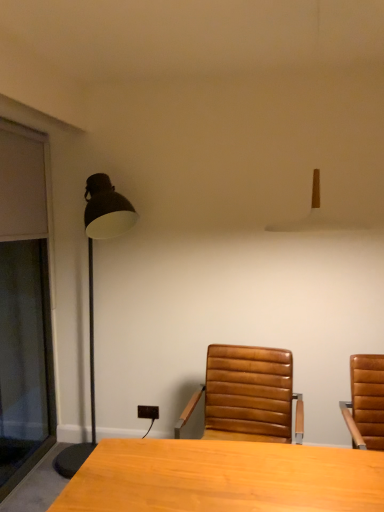
At what (x,y) coordinates should I click in order to perform the action: click on white matte lampshade at upper center, the 1th lamp viewed from the front. Please return your answer as a coordinate pair (x, y). This screenshot has height=512, width=384. Looking at the image, I should click on pos(315,216).

Based on the photo, does leather at center appear on the left side of white matte lampshade at upper center, the 1th lamp viewed from the front?

Indeed, leather at center is positioned on the left side of white matte lampshade at upper center, the 1th lamp viewed from the front.

Is leather at center placed right next to white matte lampshade at upper center, the 1th lamp viewed from the front?

No, leather at center is not in contact with white matte lampshade at upper center, the 1th lamp viewed from the front.

How many degrees apart are the facing directions of leather at center and white matte lampshade at upper center, the 2th lamp in the back-to-front sequence?

leather at center and white matte lampshade at upper center, the 2th lamp in the back-to-front sequence, are facing 4.02 degrees away from each other.

Between leather at center and white matte lampshade at upper center, the 2th lamp in the back-to-front sequence, which one has smaller size?

With smaller size is white matte lampshade at upper center, the 2th lamp in the back-to-front sequence.

Is leather at center directly adjacent to matte black floor lamp at left, which is the 1th lamp in left-to-right order?

No, leather at center is not making contact with matte black floor lamp at left, which is the 1th lamp in left-to-right order.

Relative to matte black floor lamp at left, arranged as the first lamp when viewed from the back, is leather at center in front or behind?

Visually, leather at center is located in front of matte black floor lamp at left, arranged as the first lamp when viewed from the back.

You are a GUI agent. You are given a task and a screenshot of the screen. Output one action in this format:
    pyautogui.click(x=<x>, y=<y>)
    Task: Click on the chair lying in front of the matte black floor lamp at left, which is counted as the 2th lamp, starting from the right
    This screenshot has height=512, width=384.
    Given the screenshot: What is the action you would take?
    pyautogui.click(x=248, y=396)

How different are the orientations of leather at center and matte black floor lamp at left, which is counted as the 2th lamp, starting from the right, in degrees?

4.02 degrees separate the facing orientations of leather at center and matte black floor lamp at left, which is counted as the 2th lamp, starting from the right.

Can you tell me how much transparent glass screen door at left and leather at center differ in facing direction?

There is a 93.6-degree angle between the facing directions of transparent glass screen door at left and leather at center.

Does point (29, 166) appear closer or farther from the camera than point (229, 419)?

Point (29, 166) is farther from the camera than point (229, 419).

Between transparent glass screen door at left and leather at center, which one appears on the left side from the viewer's perspective?

transparent glass screen door at left.

Which is more to the right, white matte lampshade at upper center, acting as the second lamp starting from the left, or matte black floor lamp at left, which is counted as the 2th lamp, starting from the right?

From the viewer's perspective, white matte lampshade at upper center, acting as the second lamp starting from the left, appears more on the right side.

Considering the sizes of white matte lampshade at upper center, the 1th lamp viewed from the front, and matte black floor lamp at left, acting as the 2th lamp starting from the front, in the image, is white matte lampshade at upper center, the 1th lamp viewed from the front, bigger or smaller than matte black floor lamp at left, acting as the 2th lamp starting from the front,?

Considering their sizes, white matte lampshade at upper center, the 1th lamp viewed from the front, takes up less space than matte black floor lamp at left, acting as the 2th lamp starting from the front.

Measure the distance between white matte lampshade at upper center, the 1th lamp viewed from the front, and matte black floor lamp at left, which is the 1th lamp in left-to-right order.

white matte lampshade at upper center, the 1th lamp viewed from the front, is 3.48 feet away from matte black floor lamp at left, which is the 1th lamp in left-to-right order.

Is point (282, 227) less distant than point (92, 205)?

No, (282, 227) is further to viewer.

Is matte black floor lamp at left, arranged as the first lamp when viewed from the back, positioned far away from transparent glass screen door at left?

matte black floor lamp at left, arranged as the first lamp when viewed from the back, is near transparent glass screen door at left, not far away.

Which is more to the right, matte black floor lamp at left, arranged as the first lamp when viewed from the back, or transparent glass screen door at left?

From the viewer's perspective, matte black floor lamp at left, arranged as the first lamp when viewed from the back, appears more on the right side.

From the image's perspective, is matte black floor lamp at left, arranged as the first lamp when viewed from the back, located above transparent glass screen door at left?

No, from the image's perspective, matte black floor lamp at left, arranged as the first lamp when viewed from the back, is not on top of transparent glass screen door at left.

Does matte black floor lamp at left, acting as the 2th lamp starting from the front, have a lesser height compared to transparent glass screen door at left?

Yes.

Which of these two, leather at center or transparent glass screen door at left, stands shorter?

Standing shorter between the two is leather at center.

From the image's perspective, which is above, leather at center or transparent glass screen door at left?

transparent glass screen door at left appears higher in the image.

Is leather at center further to the viewer compared to transparent glass screen door at left?

No, leather at center is in front of transparent glass screen door at left.

Do you think leather at center is within transparent glass screen door at left, or outside of it?

leather at center lies outside transparent glass screen door at left.

Which is in front, point (135, 217) or point (313, 193)?

The point (313, 193) is more forward.

Is matte black floor lamp at left, which is the 1th lamp in left-to-right order, smaller than white matte lampshade at upper center, the 2th lamp in the back-to-front sequence?

Actually, matte black floor lamp at left, which is the 1th lamp in left-to-right order, might be larger than white matte lampshade at upper center, the 2th lamp in the back-to-front sequence.

Is matte black floor lamp at left, which is counted as the 2th lamp, starting from the right, oriented away from white matte lampshade at upper center, which ranks as the first lamp in right-to-left order?

No, matte black floor lamp at left, which is counted as the 2th lamp, starting from the right, is not facing the opposite direction of white matte lampshade at upper center, which ranks as the first lamp in right-to-left order.

From a real-world perspective, is matte black floor lamp at left, which is counted as the 2th lamp, starting from the right, beneath white matte lampshade at upper center, the 2th lamp in the back-to-front sequence?

Yes, from a real-world perspective, matte black floor lamp at left, which is counted as the 2th lamp, starting from the right, is under white matte lampshade at upper center, the 2th lamp in the back-to-front sequence.

Where is `the 2nd lamp positioned above the leather at center (from the image's perspective)`? Image resolution: width=384 pixels, height=512 pixels. the 2nd lamp positioned above the leather at center (from the image's perspective) is located at coordinates (315, 216).

This screenshot has height=512, width=384. Find the location of `chair below the matte black floor lamp at left, which is the 1th lamp in left-to-right order (from the image's perspective)`. chair below the matte black floor lamp at left, which is the 1th lamp in left-to-right order (from the image's perspective) is located at coordinates (248, 396).

When comparing their distances from matte black floor lamp at left, acting as the 2th lamp starting from the front, does white matte lampshade at upper center, the 1th lamp viewed from the front, or transparent glass screen door at left seem further?

Based on the image, white matte lampshade at upper center, the 1th lamp viewed from the front, appears to be further to matte black floor lamp at left, acting as the 2th lamp starting from the front.

Which object lies further to the anchor point transparent glass screen door at left, leather at center or white matte lampshade at upper center, which ranks as the first lamp in right-to-left order?

The object further to transparent glass screen door at left is white matte lampshade at upper center, which ranks as the first lamp in right-to-left order.

From the picture: From the image, which object appears to be farther from white matte lampshade at upper center, which ranks as the first lamp in right-to-left order, matte black floor lamp at left, which is counted as the 2th lamp, starting from the right, or transparent glass screen door at left?

transparent glass screen door at left is positioned further to the anchor white matte lampshade at upper center, which ranks as the first lamp in right-to-left order.

From the image, which object appears to be farther from white matte lampshade at upper center, which ranks as the first lamp in right-to-left order, transparent glass screen door at left or matte black floor lamp at left, acting as the 2th lamp starting from the front?

transparent glass screen door at left is further to white matte lampshade at upper center, which ranks as the first lamp in right-to-left order.

Based on their spatial positions, is matte black floor lamp at left, which is the 1th lamp in left-to-right order, or leather at center further from transparent glass screen door at left?

leather at center is further to transparent glass screen door at left.

From the image, which object appears to be farther from transparent glass screen door at left, leather at center or matte black floor lamp at left, acting as the 2th lamp starting from the front?

leather at center.

From the image, which object appears to be nearer to leather at center, white matte lampshade at upper center, which ranks as the first lamp in right-to-left order, or matte black floor lamp at left, which is counted as the 2th lamp, starting from the right?

white matte lampshade at upper center, which ranks as the first lamp in right-to-left order, lies closer to leather at center than the other object.

Estimate the real-world distances between objects in this image. Which object is further from matte black floor lamp at left, arranged as the first lamp when viewed from the back, transparent glass screen door at left or white matte lampshade at upper center, the 2th lamp in the back-to-front sequence?

The object further to matte black floor lamp at left, arranged as the first lamp when viewed from the back, is white matte lampshade at upper center, the 2th lamp in the back-to-front sequence.

Locate an element on the screen. The height and width of the screenshot is (512, 384). lamp between white matte lampshade at upper center, the 2th lamp in the back-to-front sequence, and leather at center in the up-down direction is located at coordinates (92, 288).

At what (x,y) coordinates should I click in order to perform the action: click on lamp between transparent glass screen door at left and leather at center in the horizontal direction. Please return your answer as a coordinate pair (x, y). Looking at the image, I should click on (92, 288).

Image resolution: width=384 pixels, height=512 pixels. Identify the location of lamp between transparent glass screen door at left and white matte lampshade at upper center, the 1th lamp viewed from the front, from left to right. click(x=92, y=288).

The height and width of the screenshot is (512, 384). In order to click on chair between transparent glass screen door at left and white matte lampshade at upper center, the 1th lamp viewed from the front, in the horizontal direction in this screenshot , I will do `click(248, 396)`.